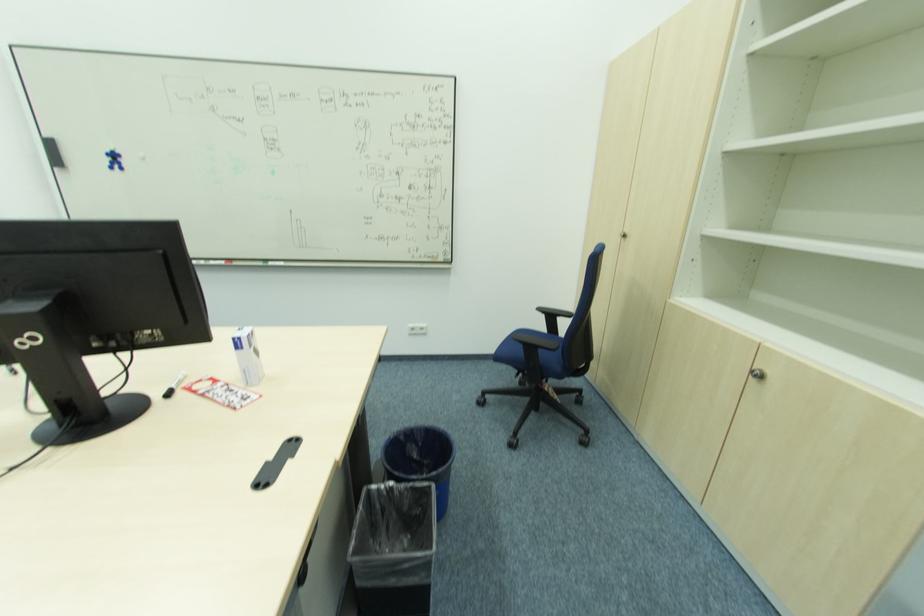
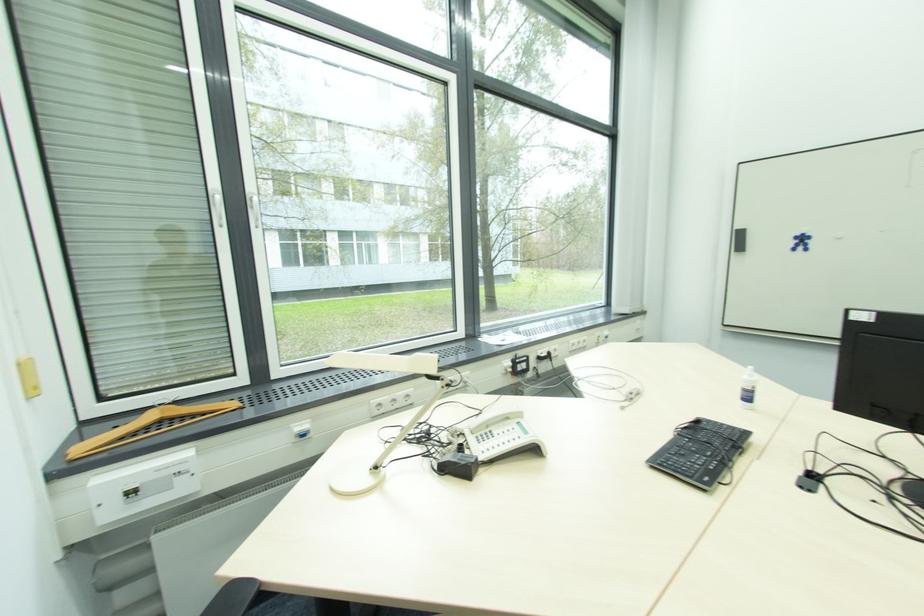
In the second image, find the point that corresponds to pixel 116 161 in the first image.

(801, 244)